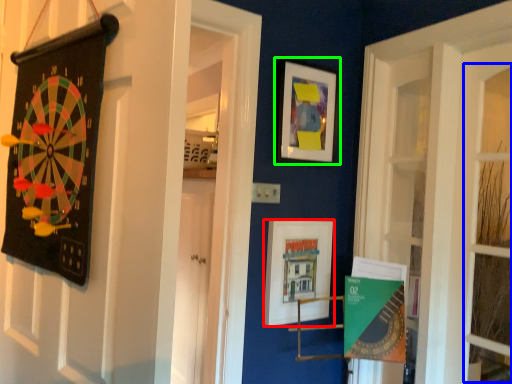
Question: Considering the real-world distances, which object is farthest from picture frame (highlighted by a red box)? window (highlighted by a blue box) or picture frame (highlighted by a green box)?

Choices:
 (A) window
 (B) picture frame

Answer: (A)